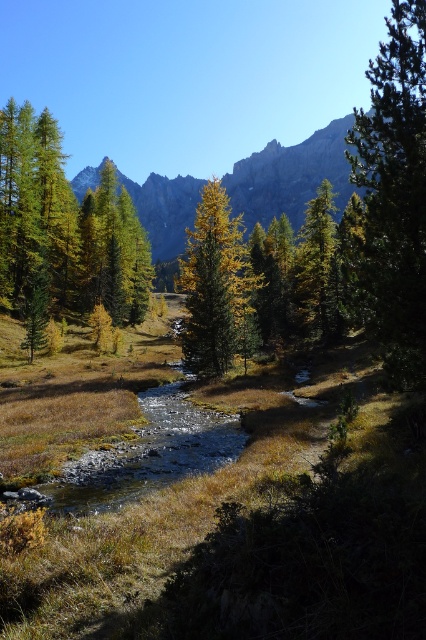
You are standing at the edge of the stream and want to walk towards the dense cluster of coniferous trees in the midground. Which object, the green leafy trees at upper center or the green matte tree at center, would you encounter first?

The green matte tree at center would be encountered first because the green leafy trees at upper center are positioned over it, meaning the green matte tree is closer to the observer.

You are planning to set up a tent in this mountain area. You need to choose between two spots. One is near the green leafy trees at upper center and the other is near the green matte tree at center. Considering the space required for the tent, which location would provide more horizontal space?

The green leafy trees at upper center are wider than the green matte tree at center, so the area near the green leafy trees at upper center would offer more horizontal space for setting up the tent.